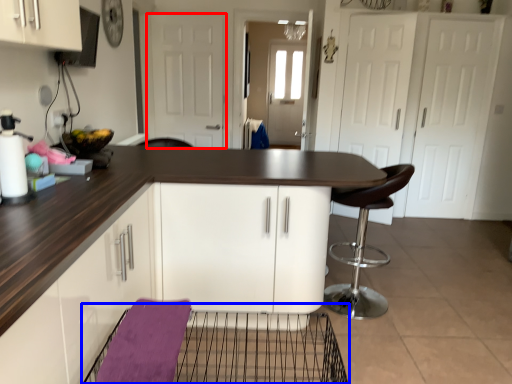
Question: Which object is further to the camera taking this photo, door (highlighted by a red box) or cage (highlighted by a blue box)?

Choices:
 (A) door
 (B) cage

Answer: (A)